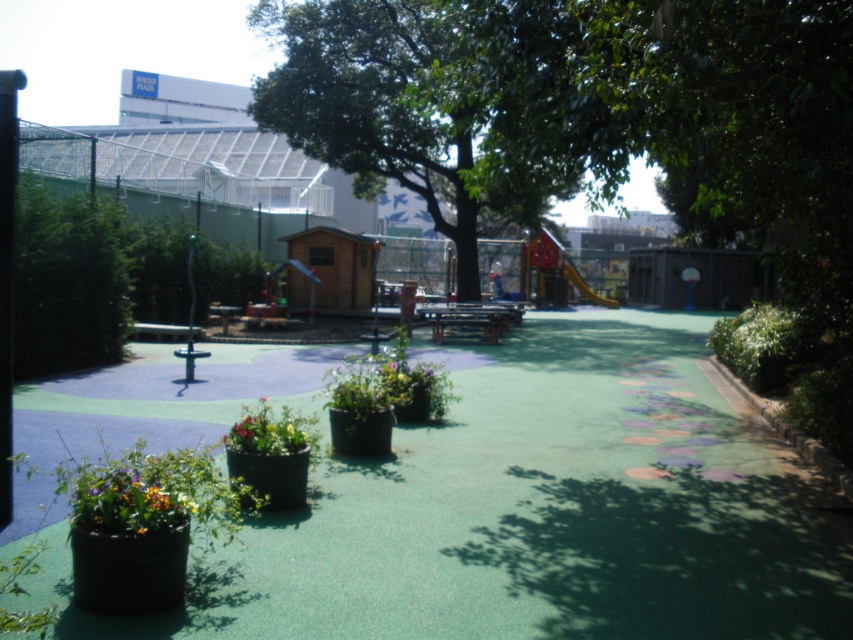
Question: Is glossy ceramic flower pot at lower left further to the viewer compared to multicolored plastic flowers at center?

Choices:
 (A) yes
 (B) no

Answer: (B)

Question: Which of the following is the farthest from the observer?

Choices:
 (A) [x=286, y=440]
 (B) [x=140, y=486]

Answer: (A)

Question: From the image, what is the correct spatial relationship of glossy ceramic flower pot at lower left in relation to multicolored plastic flowers at center?

Choices:
 (A) right
 (B) left

Answer: (B)

Question: Can you confirm if glossy ceramic flower pot at lower left is bigger than multicolored plastic flowers at center?

Choices:
 (A) no
 (B) yes

Answer: (A)